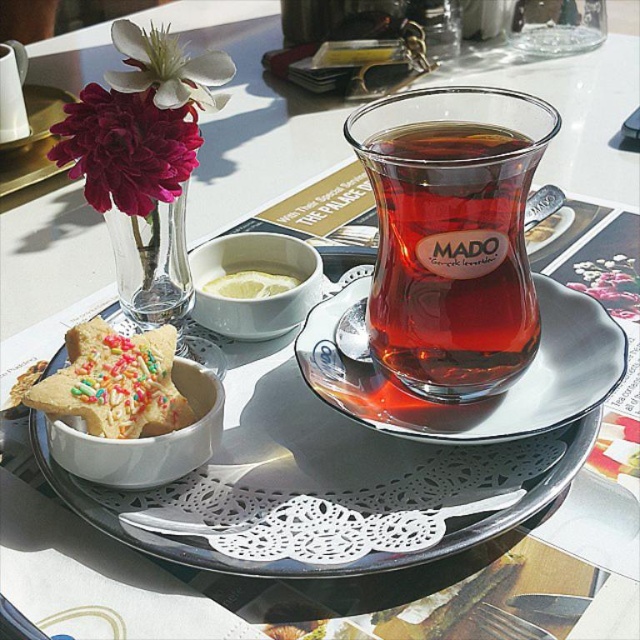
Question: Which point is closer to the camera?

Choices:
 (A) transparent glass tea at center
 (B) clear glass vase at upper left
 (C) transparent glass saucer at center

Answer: (A)

Question: Estimate the real-world distances between objects in this image. Which object is closer to the matte black tray at center?

Choices:
 (A) white matte flower at upper left
 (B) clear glass vase at upper left
 (C) transparent glass tea at center
 (D) sprinkled cookie at center

Answer: (D)

Question: In this image, where is transparent glass tea at center located relative to transparent glass saucer at center?

Choices:
 (A) above
 (B) below

Answer: (A)

Question: Does transparent glass saucer at center come behind matte glass vase at upper left?

Choices:
 (A) yes
 (B) no

Answer: (B)

Question: Which point is farther to the camera?

Choices:
 (A) matte black tray at center
 (B) sprinkled cookie at center

Answer: (B)

Question: Is transparent glass saucer at center to the left of sprinkled cookie at center from the viewer's perspective?

Choices:
 (A) yes
 (B) no

Answer: (B)